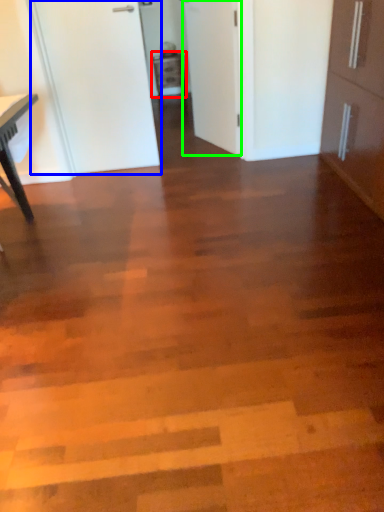
Question: Which is farther away from cabinetry (highlighted by a red box)? door (highlighted by a blue box) or door (highlighted by a green box)?

Choices:
 (A) door
 (B) door

Answer: (A)